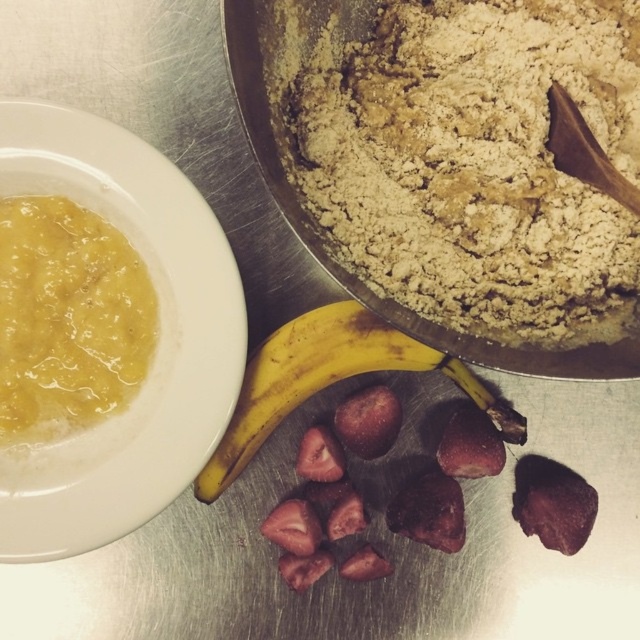
You are a chef preparing a dish and need to place a garnish at the point specified in the image. The point is located at coordinates [67,317]. Which object from the scene is this point located on?

The point at coordinates [67,317] is located on the yellow smoothie at left.